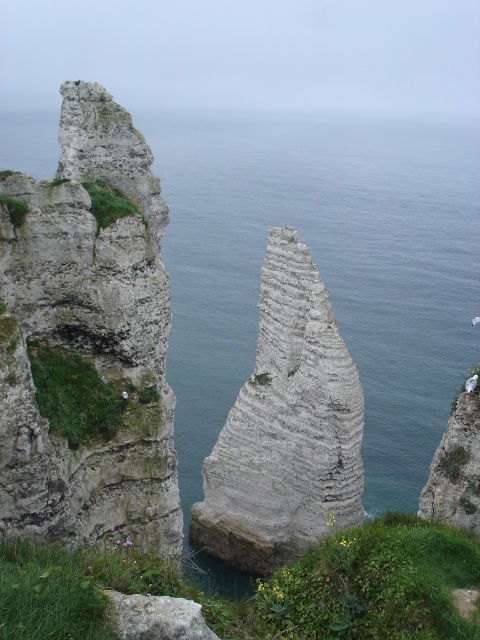
You are standing on a boat in the middle of the sea looking at the scene. Which object, the blue water at center or the gray stone rock at center, is closer to you?

The blue water at center is closer to you because it is in front of the gray stone rock at center.

You are a photographer standing on a cliff edge. You want to capture the blue water at center and the gray rough rock at lower center in a single shot. Which object will appear larger in the photo due to its height?

The blue water at center will appear larger in the photo because it has a greater height compared to the gray rough rock at lower center.

You are a photographer planning to capture the coastal scene. You want to ensure that both the blue water at center and the gray stone rock at center are clearly visible in your shot. Given their sizes, which object should you focus on first to ensure both are in frame?

The blue water at center has a larger size compared to the gray stone rock at center, so you should focus on the blue water at center first to ensure both fit within the frame.